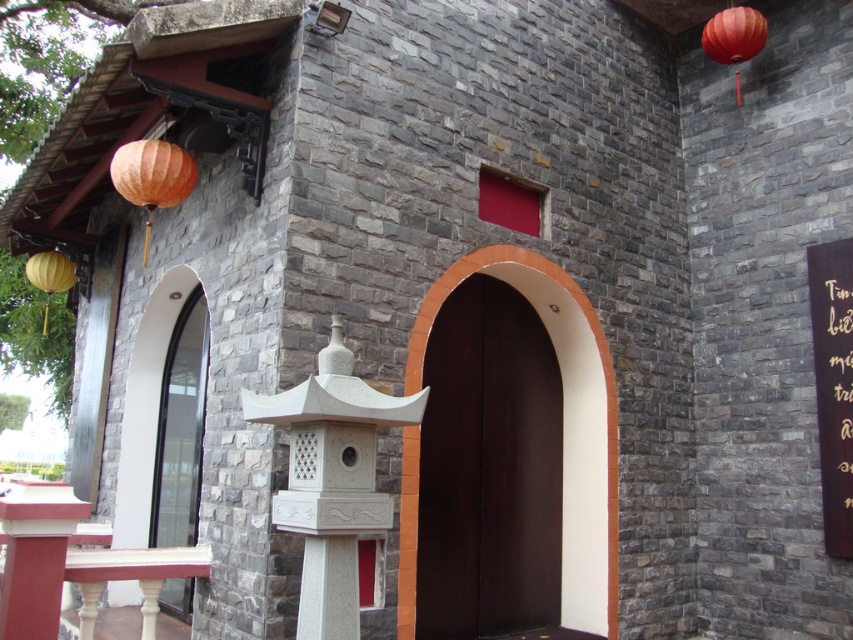
Question: Estimate the real-world distances between objects in this image. Which object is closer to the wooden sign at right?

Choices:
 (A) matte orange lantern at upper right
 (B) matte yellow lantern at left
 (C) white stone lantern at center

Answer: (A)

Question: Is dark wood door at center smaller than orange matte lantern at upper left?

Choices:
 (A) no
 (B) yes

Answer: (A)

Question: Where is matte orange lantern at upper right located in relation to matte yellow lantern at left in the image?

Choices:
 (A) left
 (B) right

Answer: (B)

Question: Among these points, which one is farthest from the camera?

Choices:
 (A) (822, 381)
 (B) (611, 627)
 (C) (811, 262)

Answer: (C)

Question: Which is nearer to the orange matte lantern at upper left?

Choices:
 (A) wooden sign at right
 (B) matte orange lantern at upper right

Answer: (B)

Question: Can you confirm if dark wood door at center is positioned below black wood sign at upper right?

Choices:
 (A) yes
 (B) no

Answer: (A)